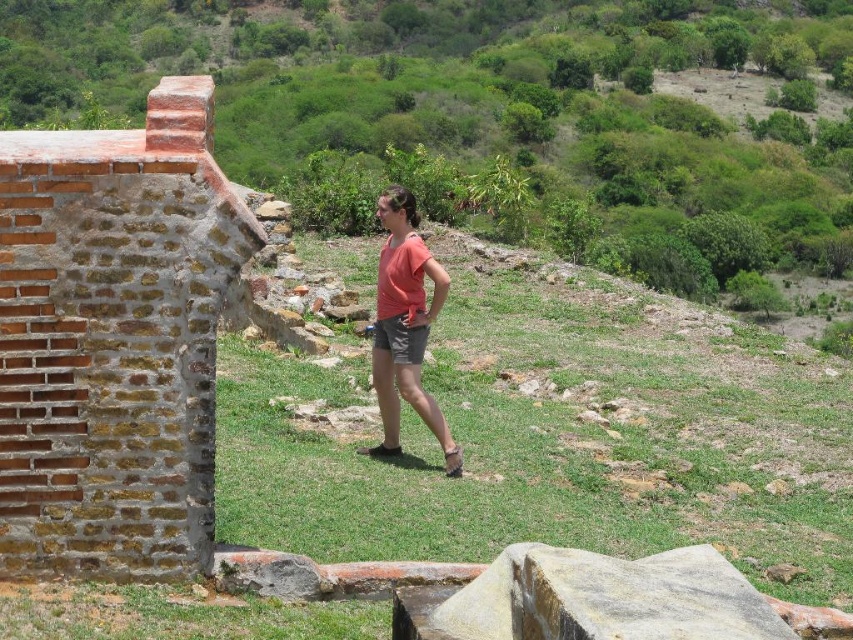
You are standing at the viewpoint of the image and want to reach the point marked as point [405,221]. Given that your walking speed is 1.5 meters per second, approximately how many seconds will it take you to reach that point?

The distance between you and point [405,221] is 12.17 meters. At a walking speed of 1.5 meters per second, it would take approximately 8.11 seconds to reach the point.